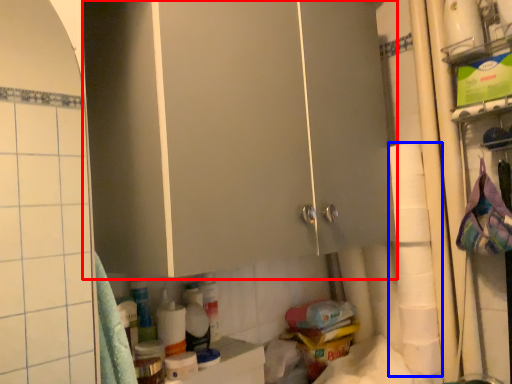
Question: Among these objects, which one is nearest to the camera, cabinetry (highlighted by a red box) or toilet paper (highlighted by a blue box)?

Choices:
 (A) cabinetry
 (B) toilet paper

Answer: (A)